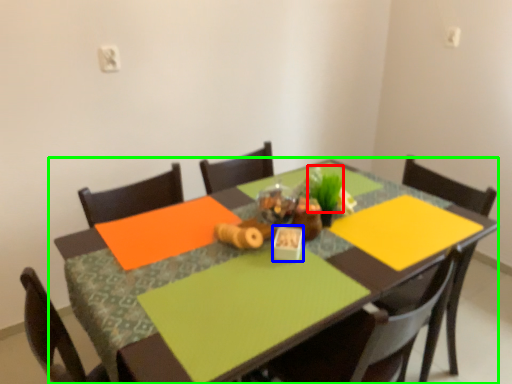
Question: Considering the real-world distances, which object is farthest from plant (highlighted by a red box)? tableware (highlighted by a blue box) or table (highlighted by a green box)?

Choices:
 (A) tableware
 (B) table

Answer: (B)